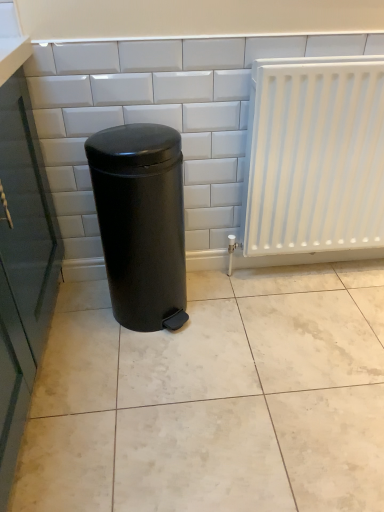
Question: Is white glossy tile at center at the back of black matte waste container at center?

Choices:
 (A) no
 (B) yes

Answer: (B)

Question: Considering the relative sizes of black matte waste container at center and white glossy tile at center in the image provided, is black matte waste container at center taller than white glossy tile at center?

Choices:
 (A) no
 (B) yes

Answer: (A)

Question: From a real-world perspective, is black matte waste container at center physically below white glossy tile at center?

Choices:
 (A) no
 (B) yes

Answer: (B)

Question: Can you confirm if black matte waste container at center is wider than white glossy tile at center?

Choices:
 (A) yes
 (B) no

Answer: (A)

Question: Is black matte waste container at center positioned far away from white glossy tile at center?

Choices:
 (A) yes
 (B) no

Answer: (B)

Question: From the image's perspective, relative to white matte radiator at right, is black matte waste container at center above or below?

Choices:
 (A) below
 (B) above

Answer: (A)

Question: Is black matte waste container at center situated inside white matte radiator at right or outside?

Choices:
 (A) outside
 (B) inside

Answer: (A)

Question: From a real-world perspective, is black matte waste container at center above or below white matte radiator at right?

Choices:
 (A) below
 (B) above

Answer: (A)

Question: In terms of height, does black matte waste container at center look taller or shorter compared to white matte radiator at right?

Choices:
 (A) tall
 (B) short

Answer: (B)

Question: Choose the correct answer: Is black matte waste container at center inside white glossy tile at center or outside it?

Choices:
 (A) outside
 (B) inside

Answer: (A)

Question: From a real-world perspective, is black matte waste container at center positioned above or below white glossy tile at center?

Choices:
 (A) above
 (B) below

Answer: (B)

Question: In the image, is black matte waste container at center positioned in front of or behind white glossy tile at center?

Choices:
 (A) front
 (B) behind

Answer: (A)

Question: Considering the relative positions of black matte waste container at center and white glossy tile at center in the image provided, is black matte waste container at center to the left or to the right of white glossy tile at center?

Choices:
 (A) right
 (B) left

Answer: (B)

Question: Considering the positions of point (306, 91) and point (49, 133), is point (306, 91) closer or farther from the camera than point (49, 133)?

Choices:
 (A) closer
 (B) farther

Answer: (A)

Question: In the image, is white matte radiator at right on the left side or the right side of white glossy tile at center?

Choices:
 (A) right
 (B) left

Answer: (A)